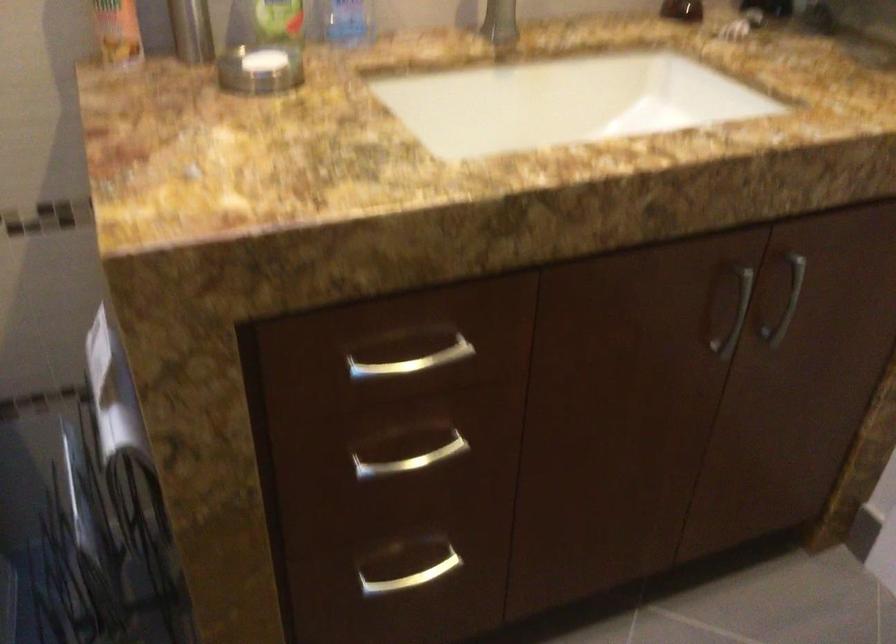
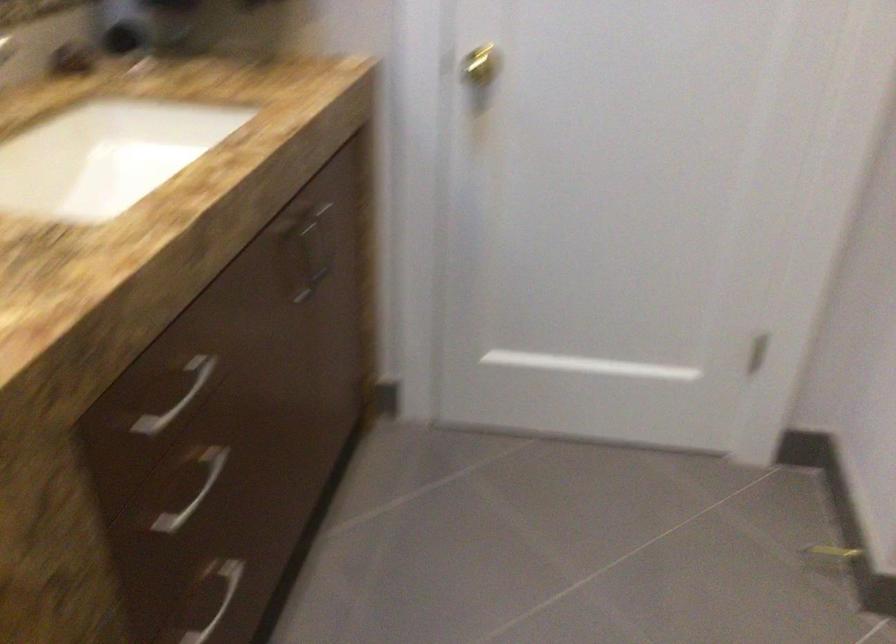
The point at (416, 567) is marked in the first image. Where is the corresponding point in the second image?

(211, 600)